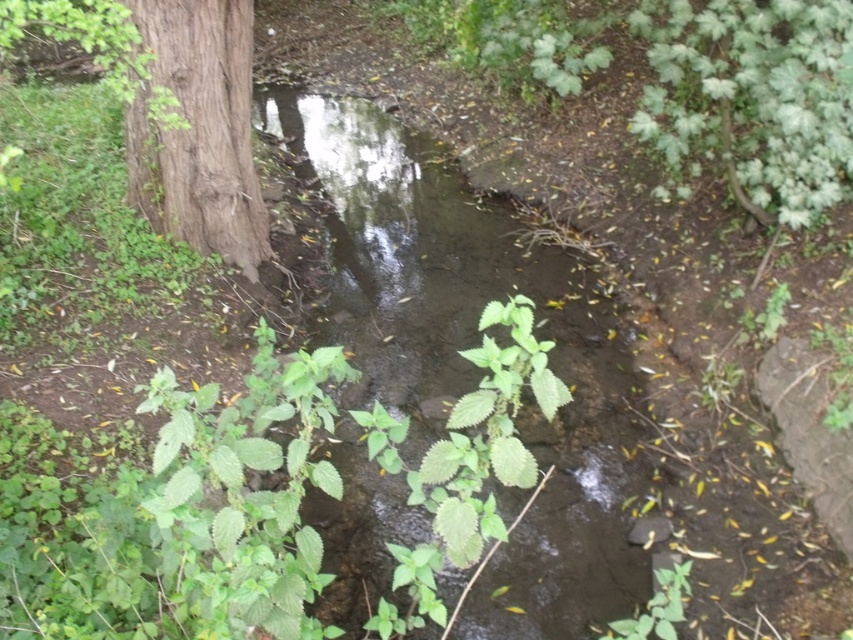
You are standing at the edge of the stream and want to reach the transparent water at center to take a closer look. Can you safely walk towards it without getting your feet wet?

The transparent water at center is 2.38 meters away from you, so yes, you can safely walk towards it without getting your feet wet as the distance is manageable and the stream is shallow and narrow.

You are a hiker trying to cross the stream. You see the transparent water at center and the brown rough tree trunk at left. Which one is closer to you as you stand on the bank?

The transparent water at center is closer to you because it is in front of the brown rough tree trunk at left, meaning the tree trunk is further away.